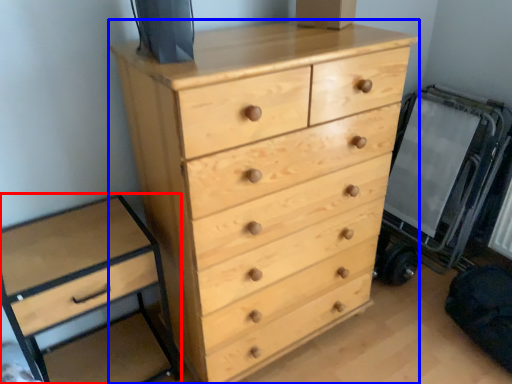
Question: Which object appears closest to the camera in this image, chest of drawers (highlighted by a red box) or chest of drawers (highlighted by a blue box)?

Choices:
 (A) chest of drawers
 (B) chest of drawers

Answer: (B)